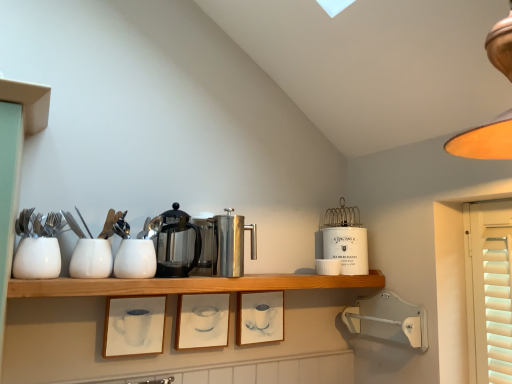
Question: Which direction should I rotate to face white ceramic canister at upper center, placed as the first appliance when sorted from right to left, — up or down?

Choices:
 (A) up
 (B) down

Answer: (B)

Question: From the image's perspective, is matte white picture frame at center, positioned as the 1th picture frame in right-to-left order, under white matte cup at left, which is counted as the 4th tableware, starting from the back?

Choices:
 (A) yes
 (B) no

Answer: (A)

Question: From the image's perspective, is matte white picture frame at center, positioned as the 3th picture frame in left-to-right order, over white matte cup at left, placed as the fourth tableware when sorted from right to left?

Choices:
 (A) no
 (B) yes

Answer: (A)

Question: From a real-world perspective, is matte white picture frame at center, positioned as the 3th picture frame in left-to-right order, on top of white matte cup at left, which ranks as the first tableware in left-to-right order?

Choices:
 (A) yes
 (B) no

Answer: (B)

Question: Can you confirm if matte white picture frame at center, positioned as the 1th picture frame in right-to-left order, is wider than white matte cup at left, which ranks as the first tableware in left-to-right order?

Choices:
 (A) yes
 (B) no

Answer: (B)

Question: Does matte white picture frame at center, positioned as the 3th picture frame in left-to-right order, turn towards white matte cup at left, which is counted as the 4th tableware, starting from the back?

Choices:
 (A) yes
 (B) no

Answer: (B)

Question: Is white matte cup at left, placed as the fourth tableware when sorted from right to left, surrounded by matte white picture frame at center, positioned as the 3th picture frame in left-to-right order?

Choices:
 (A) no
 (B) yes

Answer: (A)

Question: From a real-world perspective, is polished stainless steel coffee press at center, marked as the second appliance in a left-to-right arrangement, beneath wooden shelf at center?

Choices:
 (A) no
 (B) yes

Answer: (A)

Question: Can you confirm if polished stainless steel coffee press at center, marked as the second appliance in a left-to-right arrangement, is bigger than wooden shelf at center?

Choices:
 (A) no
 (B) yes

Answer: (A)

Question: From a real-world perspective, does polished stainless steel coffee press at center, the 1th appliance positioned from the front, stand above wooden shelf at center?

Choices:
 (A) yes
 (B) no

Answer: (A)

Question: From the image's perspective, is polished stainless steel coffee press at center, the 1th appliance positioned from the front, on wooden shelf at center?

Choices:
 (A) yes
 (B) no

Answer: (A)

Question: Is polished stainless steel coffee press at center, acting as the second appliance starting from the right, at the right side of wooden shelf at center?

Choices:
 (A) no
 (B) yes

Answer: (B)

Question: Can you confirm if polished stainless steel coffee press at center, the 1th appliance positioned from the front, is taller than wooden shelf at center?

Choices:
 (A) yes
 (B) no

Answer: (A)

Question: Is matte white picture frame at center, which is counted as the 2th picture frame, starting from the left, facing away from polished stainless steel coffee pot at center?

Choices:
 (A) yes
 (B) no

Answer: (B)